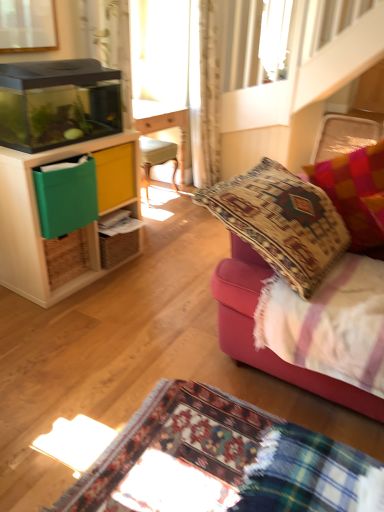
The height and width of the screenshot is (512, 384). I want to click on free space in front of matte wood cabinet at left, so click(81, 322).